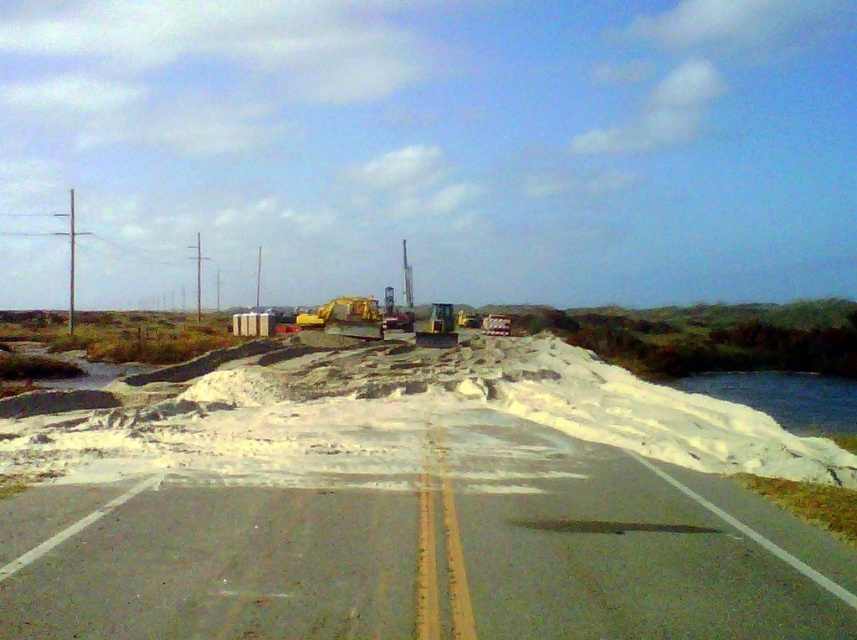
Between gray asphalt highway at center and yellow rubber tractor at center, which one has less height?

With less height is gray asphalt highway at center.

Between gray asphalt highway at center and yellow rubber tractor at center, which one is positioned lower?

Positioned lower is gray asphalt highway at center.

Does point (469, 502) come farther from viewer compared to point (316, 317)?

No, (469, 502) is in front of (316, 317).

Identify the location of gray asphalt highway at center. (423, 550).

Is point (514, 474) positioned after point (770, 372)?

No, (514, 474) is closer to viewer.

Is gray asphalt highway at center below white snow at lower right?

No, gray asphalt highway at center is not below white snow at lower right.

The height and width of the screenshot is (640, 857). I want to click on gray asphalt highway at center, so click(423, 550).

Is the position of white snow at lower right less distant than that of yellow rubber tractor at center?

Yes, white snow at lower right is in front of yellow rubber tractor at center.

Does white snow at lower right have a larger size compared to yellow rubber tractor at center?

Incorrect, white snow at lower right is not larger than yellow rubber tractor at center.

Describe the element at coordinates (784, 397) in the screenshot. This screenshot has height=640, width=857. I see `white snow at lower right` at that location.

What are the coordinates of `white snow at lower right` in the screenshot? It's located at (784, 397).